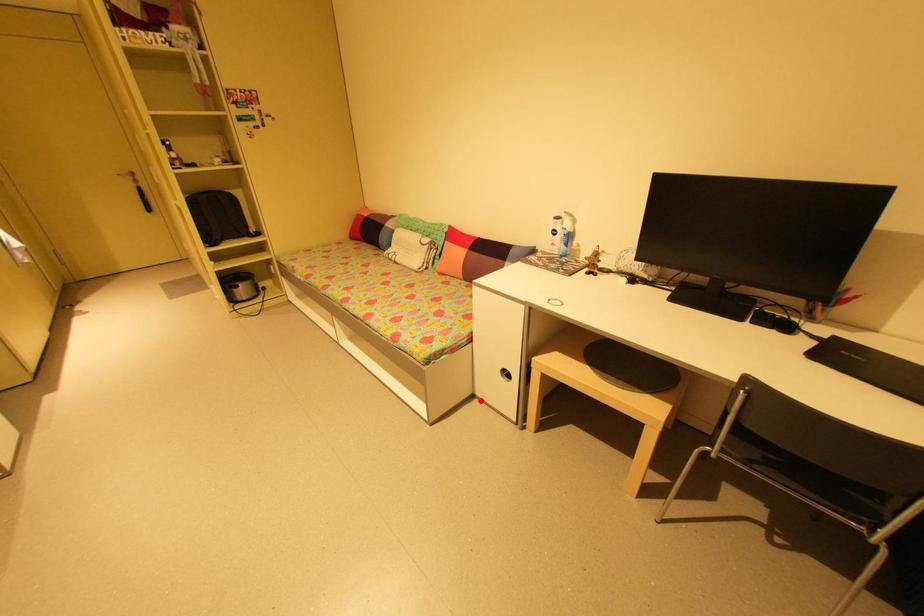
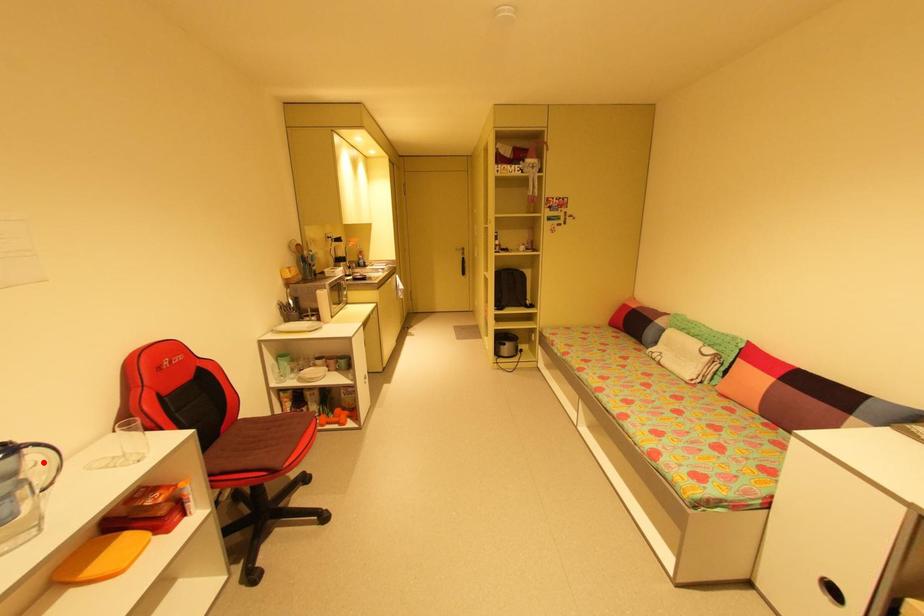
I am providing you with two images of the same scene from different viewpoints. A red point is marked on the first image and another point is marked on the second image. Do the highlighted points in image1 and image2 indicate the same real-world spot?

No